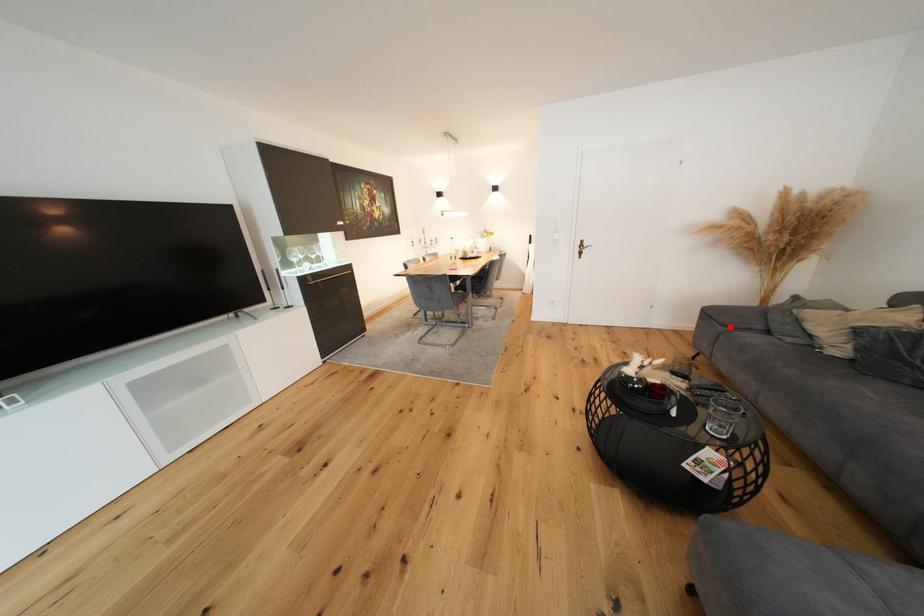
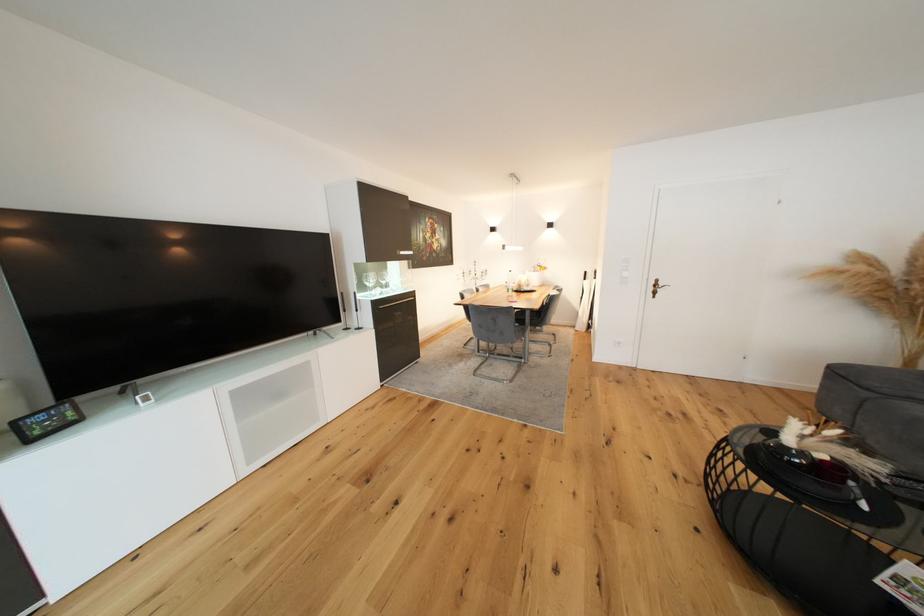
Find the pixel in the second image that matches the highlighted location in the first image.

(874, 391)